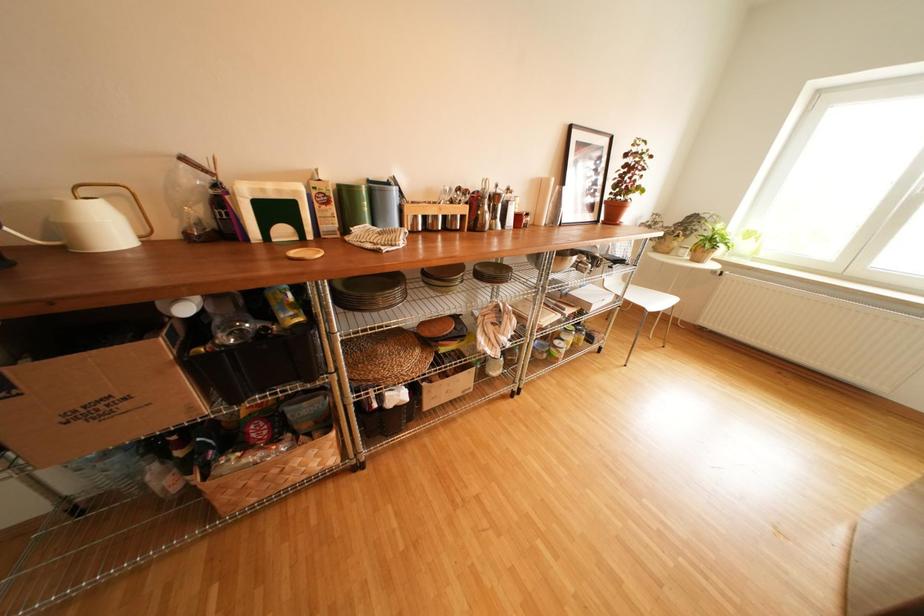
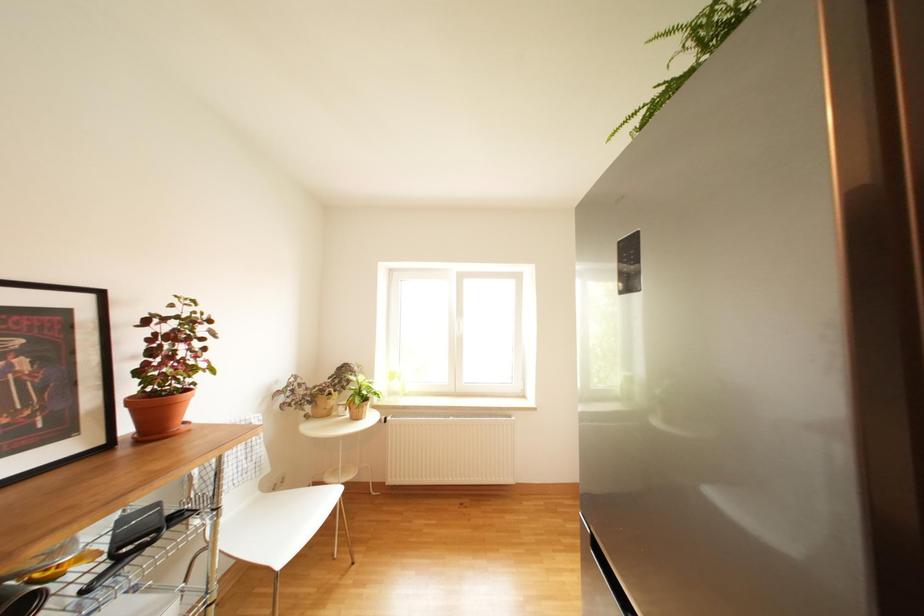
Question: The camera is either moving clockwise (left) or counter-clockwise (right) around the object. The first image is from the beginning of the video and the second image is from the end. Is the camera moving left or right when shooting the video?

Choices:
 (A) Left
 (B) Right

Answer: (A)